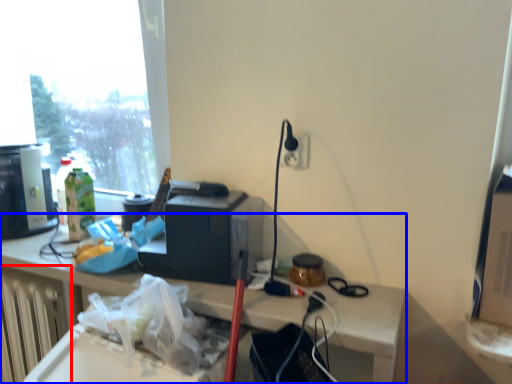
Question: Which object appears closest to the camera in this image, radiator (highlighted by a red box) or desk (highlighted by a blue box)?

Choices:
 (A) radiator
 (B) desk

Answer: (B)